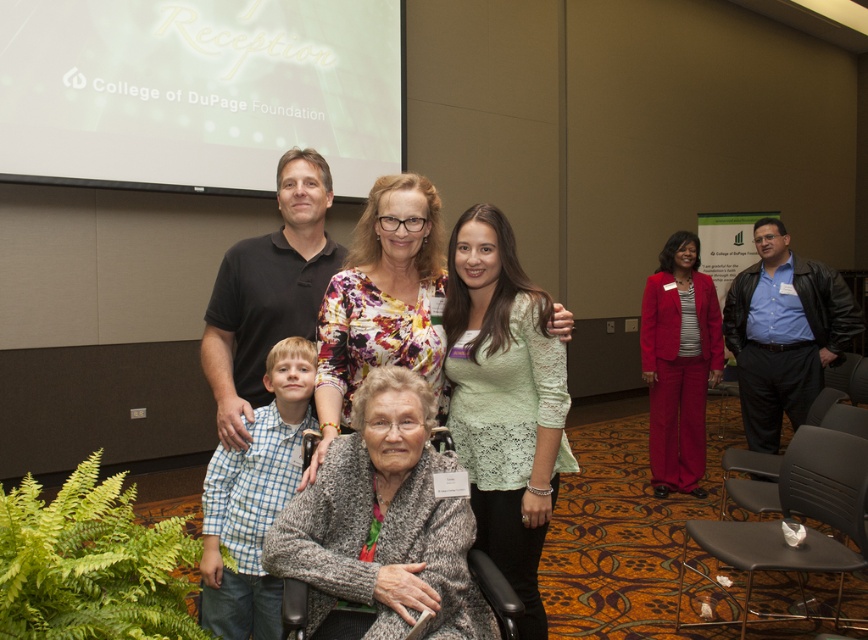
Question: Which point appears farthest from the camera in this image?

Choices:
 (A) (116, 8)
 (B) (386, 305)
 (C) (669, 465)
 (D) (442, 230)

Answer: (D)

Question: Does floral fabric blouse at center appear under velvet red suit at right?

Choices:
 (A) no
 (B) yes

Answer: (A)

Question: In this image, where is white matte projection screen at upper center located relative to velvet red suit at right?

Choices:
 (A) right
 (B) left

Answer: (B)

Question: Among these objects, which one is farthest from the camera?

Choices:
 (A) velvet red suit at right
 (B) white matte projection screen at upper center

Answer: (A)

Question: Does gray knitted sweater at center have a greater width compared to lace fabric sweater at center?

Choices:
 (A) yes
 (B) no

Answer: (A)

Question: Among these objects, which one is farthest from the camera?

Choices:
 (A) lace fabric sweater at center
 (B) floral fabric blouse at center

Answer: (A)